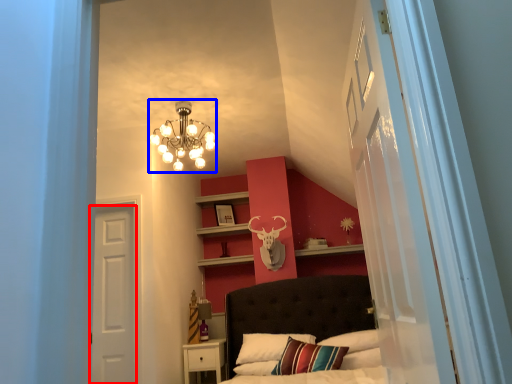
Question: Which object is further to the camera taking this photo, door (highlighted by a red box) or lamp (highlighted by a blue box)?

Choices:
 (A) door
 (B) lamp

Answer: (A)